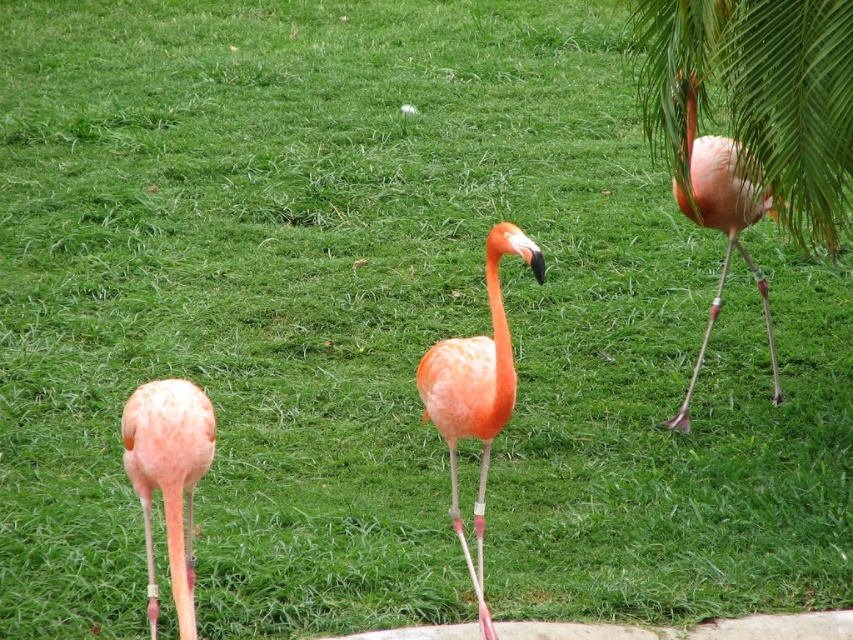
Consider the image. You are a photographer trying to capture a photo of the two flamingos. You need to position yourself so that both the pink feathered flamingo at upper right and the pink matte flamingo at lower left are visible in the frame. Based on their positions, which side of the image should you stand to ensure both are in view?

You should stand on the left side of the image to ensure both the pink feathered flamingo at upper right and the pink matte flamingo at lower left are visible, as the pink feathered flamingo at upper right is positioned to the right of the pink matte flamingo at lower left.

You are a photographer trying to capture the pink matte flamingo at lower left and the pink matte flamingo at upper right in a single shot. Which flamingo will appear smaller in the photo?

The pink matte flamingo at lower left will appear smaller in the photo because it is shorter than the pink matte flamingo at upper right.